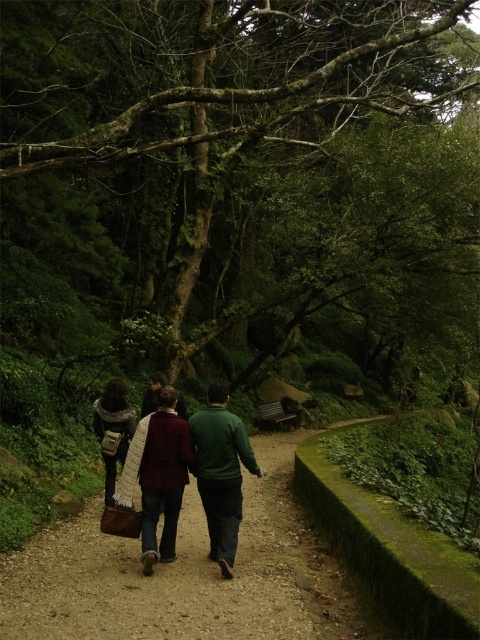
You are a hiker following the group along the path. You notice two points marked on your map at coordinates point (98, 563) and point (110, 460). Since you want to catch up with the group, which coordinate should you head towards first?

You should head towards point (98, 563) first because it is in front of point (110, 460), meaning it is closer to the direction the group is moving.

You are standing at the camera position and want to call out to the person wearing the dark brown leather jacket at center. Considering the distance, do you think your voice will carry clearly to them without needing to shout?

The dark brown leather jacket at center is 6.11 meters away from the camera. At this distance, your voice may not carry clearly without raising your volume slightly, but shouting might not be necessary unless there is significant wind or background noise interfering.